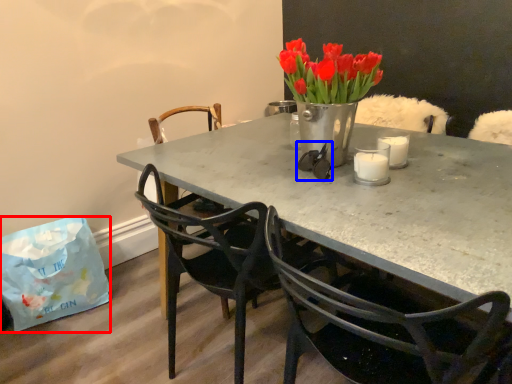
Question: Which of the following is the closest to the observer, handbag (highlighted by a red box) or glasses (highlighted by a blue box)?

Choices:
 (A) handbag
 (B) glasses

Answer: (B)